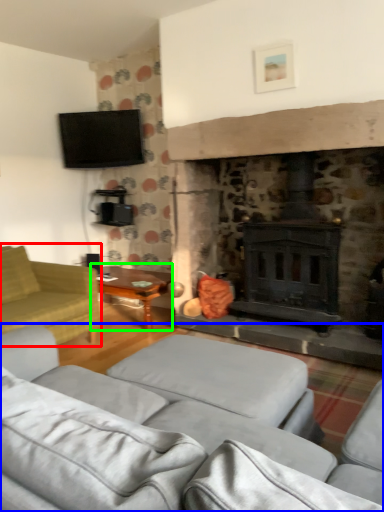
Question: Which object is positioned closest to studio couch (highlighted by a red box)? Select from studio couch (highlighted by a blue box) and table (highlighted by a green box).

Choices:
 (A) studio couch
 (B) table

Answer: (B)